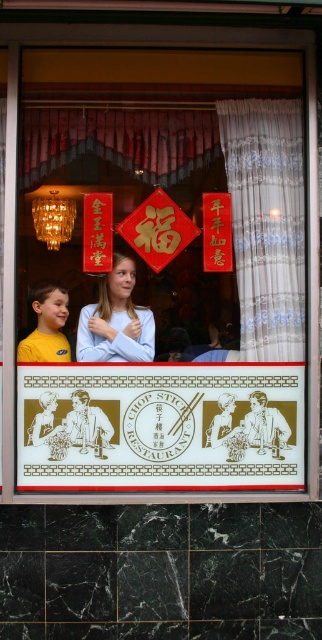
You are a customer standing outside the Chop Stick Restaurant. You look through the storefront window and see the gold paper sign at center and the light blue fabric at center. Which object is positioned to the right of the other?

The gold paper sign at center is to the right of the light blue fabric at center.

You are standing outside the Chop Stick Restaurant looking at the storefront window. You notice a point marked at coordinates (115, 321). What object or feature is located at this point?

The point at coordinates (115, 321) corresponds to the light blue fabric at center.